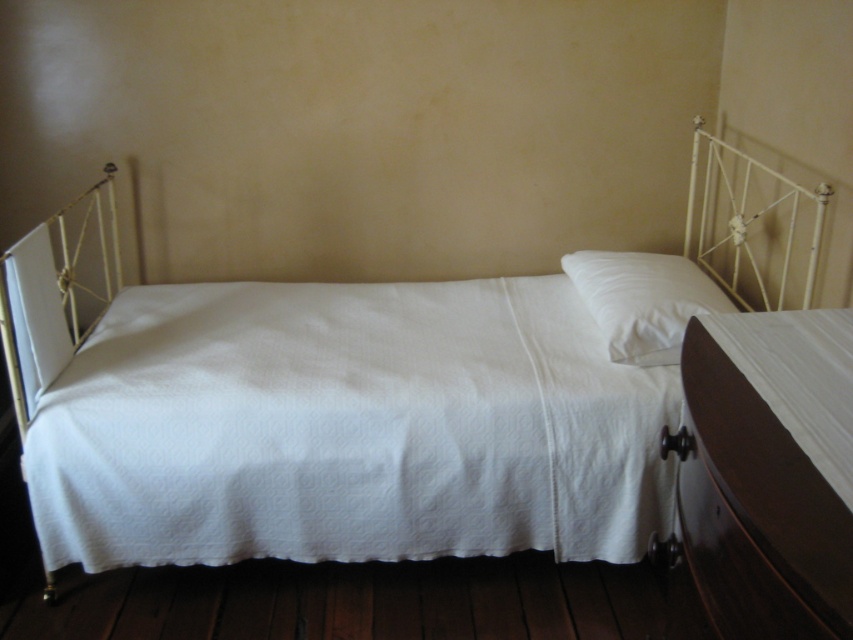
Is point (138, 321) positioned after point (616, 324)?

Yes, point (138, 321) is farther from viewer.

Is point (473, 280) positioned before point (592, 264)?

That is False.

You are a GUI agent. You are given a task and a screenshot of the screen. Output one action in this format:
    pyautogui.click(x=<x>, y=<y>)
    Task: Click on the white quilted fabric at center
    This screenshot has width=853, height=640.
    Given the screenshot: What is the action you would take?
    tap(347, 428)

How much distance is there between white quilted fabric at center and white metal headboard at upper right?

white quilted fabric at center is 33.05 inches away from white metal headboard at upper right.

Describe the element at coordinates (347, 428) in the screenshot. This screenshot has height=640, width=853. I see `white quilted fabric at center` at that location.

The height and width of the screenshot is (640, 853). I want to click on white quilted fabric at center, so click(x=347, y=428).

Does white metal headboard at upper right have a smaller size compared to white soft pillow at center?

Incorrect, white metal headboard at upper right is not smaller in size than white soft pillow at center.

Does point (808, 284) come closer to viewer compared to point (664, 300)?

Yes, point (808, 284) is closer to viewer.

Image resolution: width=853 pixels, height=640 pixels. I want to click on white metal headboard at upper right, so click(750, 225).